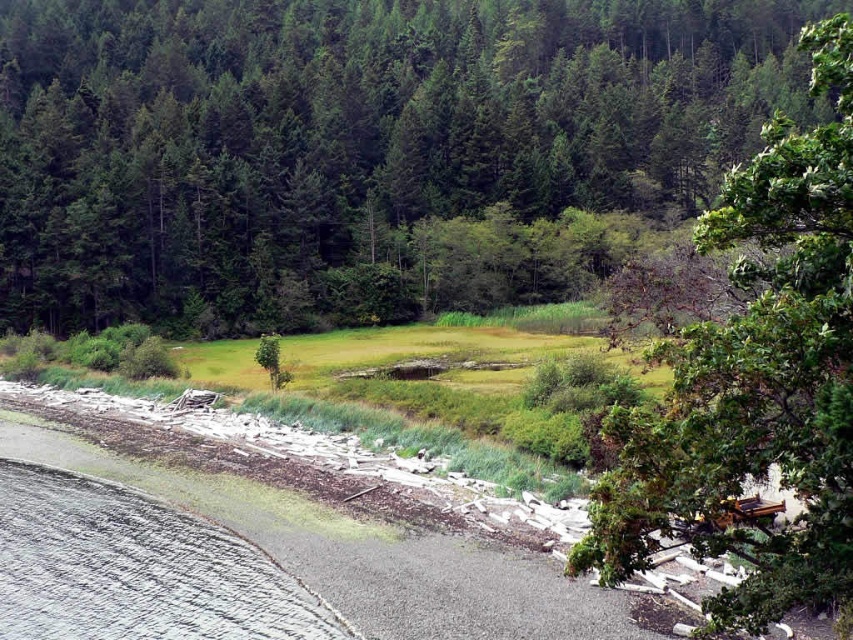
Question: Among these objects, which one is farthest from the camera?

Choices:
 (A) green leafy tree at upper right
 (B) green leafy tree at center

Answer: (B)

Question: Is green leafy tree at center thinner than green leafy tree at upper right?

Choices:
 (A) no
 (B) yes

Answer: (A)

Question: Which point is closer to the camera?

Choices:
 (A) green leafy tree at upper right
 (B) green leafy tree at center

Answer: (A)

Question: Which point is closer to the camera taking this photo?

Choices:
 (A) (827, 424)
 (B) (547, 208)

Answer: (A)

Question: Can you confirm if green leafy tree at center is positioned below green leafy tree at upper right?

Choices:
 (A) yes
 (B) no

Answer: (B)

Question: In this image, where is green leafy tree at center located relative to green leafy tree at upper right?

Choices:
 (A) below
 (B) above

Answer: (B)